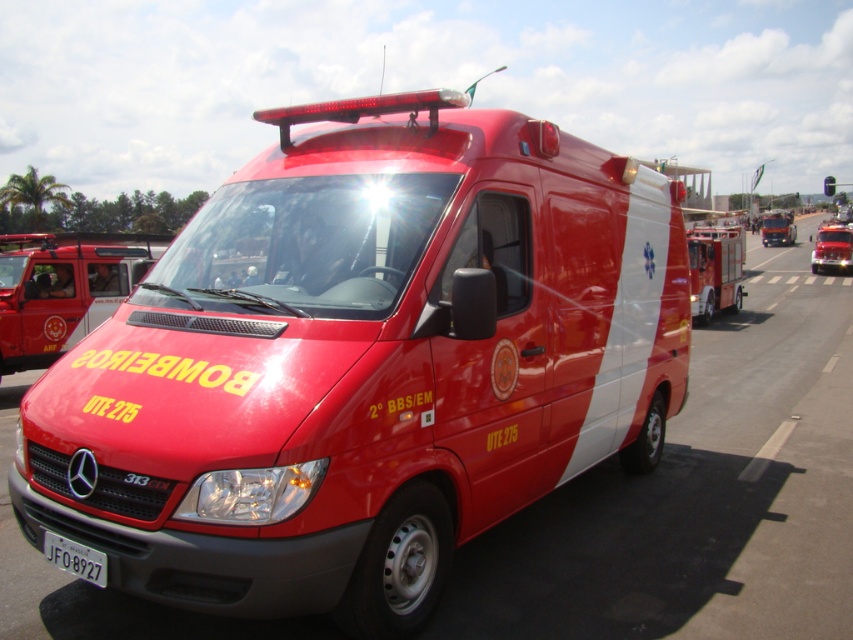
Between shiny red fire truck at left and shiny red fire truck at right, which one has less height?

With less height is shiny red fire truck at right.

Does point (44, 330) come in front of point (724, 266)?

Yes.

Identify the location of shiny red fire truck at left. This screenshot has width=853, height=640. (62, 289).

Between point (45, 285) and point (44, 538), which one is positioned behind?

Point (45, 285)

What do you see at coordinates (62, 289) in the screenshot? This screenshot has width=853, height=640. I see `shiny red fire truck at left` at bounding box center [62, 289].

Describe the element at coordinates (62, 289) in the screenshot. I see `shiny red fire truck at left` at that location.

The image size is (853, 640). Identify the location of shiny red fire truck at left. pyautogui.click(x=62, y=289).

Can you confirm if shiny red fire truck at right is bigger than white plastic license plate at lower center?

Yes.

Does shiny red fire truck at right have a lesser width compared to white plastic license plate at lower center?

Yes, shiny red fire truck at right is thinner than white plastic license plate at lower center.

The height and width of the screenshot is (640, 853). I want to click on shiny red fire truck at right, so click(x=715, y=269).

Identify the location of shiny red fire truck at right. (715, 269).